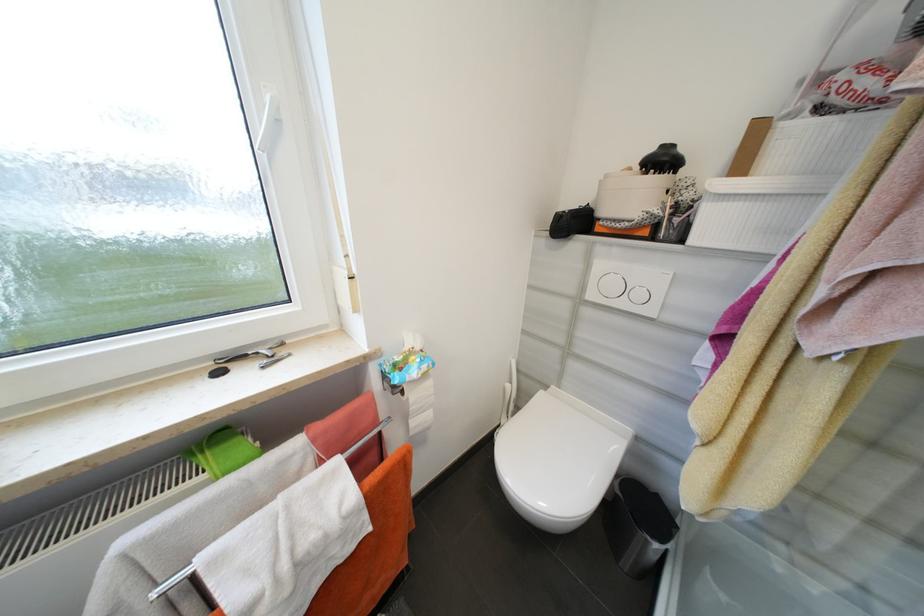
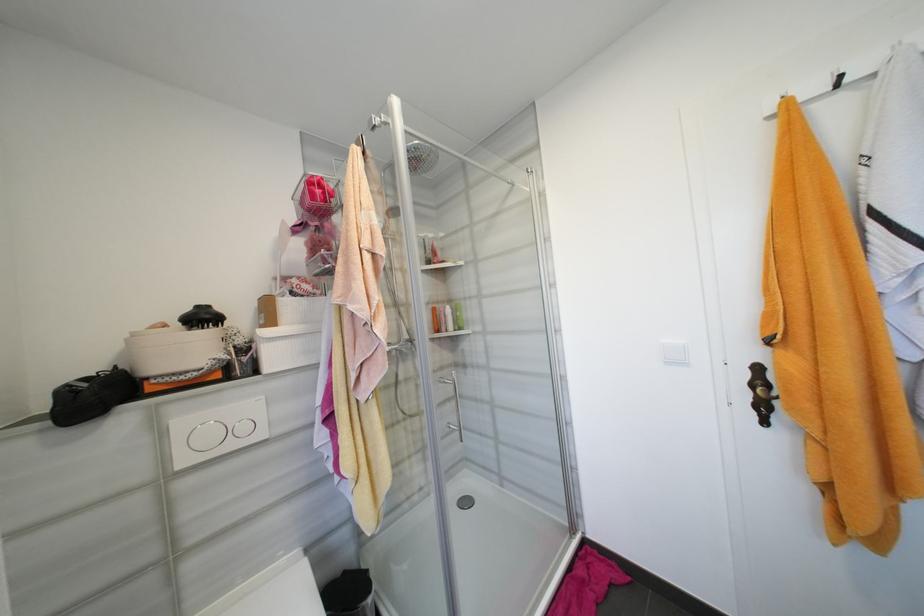
In the second image, find the point that corresponds to the point at 697,208 in the first image.

(256, 349)